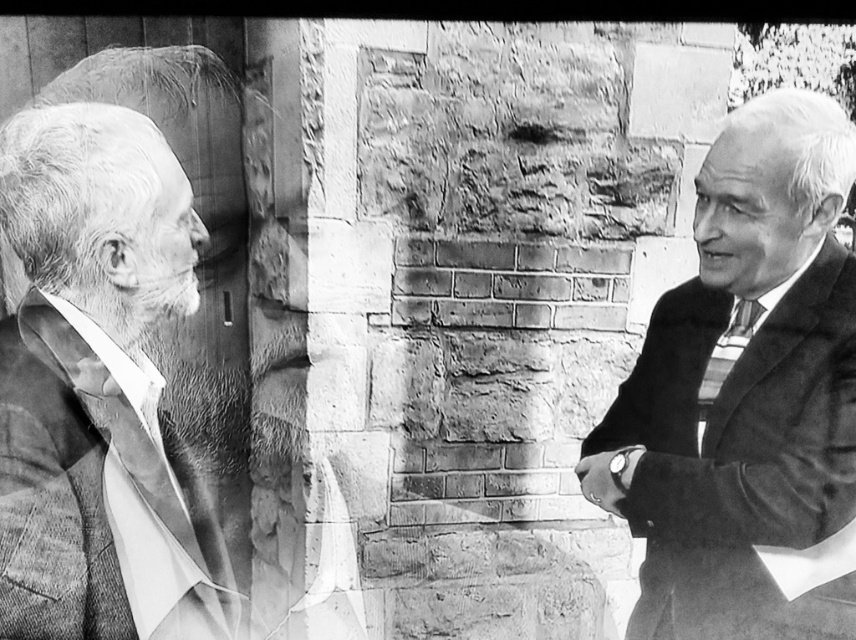
You are a photographer analyzing the composition of this black and white photo. You notice a specific point at coordinates (94, 378). What object is located at that point?

The gray wool suit at left is located at point (94, 378).

Based on the scene description, where exactly is the gray wool suit at left located in the image?

The gray wool suit at left is located at point (94, 378).